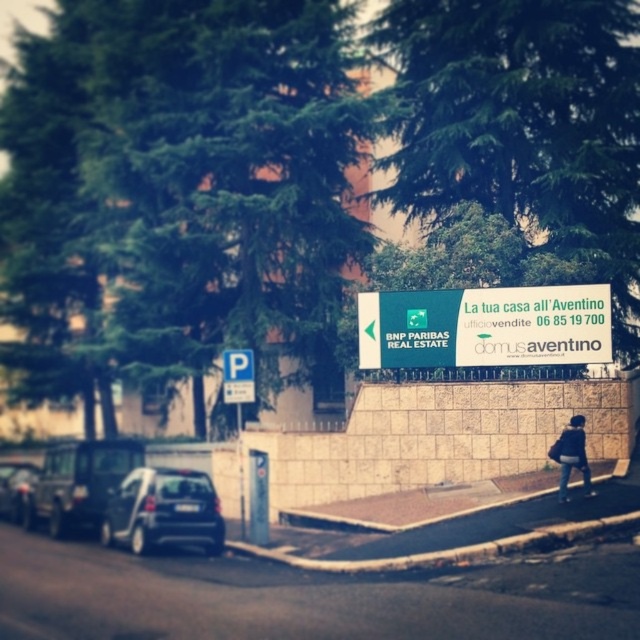
Who is taller, green leafy tree at upper center or black matte car at left?

black matte car at left

Can you confirm if green leafy tree at upper center is positioned below black matte car at left?

No, green leafy tree at upper center is not below black matte car at left.

The image size is (640, 640). What do you see at coordinates (522, 124) in the screenshot?
I see `green leafy tree at upper center` at bounding box center [522, 124].

What are the coordinates of `green leafy tree at upper center` in the screenshot? It's located at (522, 124).

Does dark blue jeans at lower right appear under metallic silver car at left?

No, dark blue jeans at lower right is not below metallic silver car at left.

Who is positioned more to the right, dark blue jeans at lower right or metallic silver car at left?

Positioned to the right is dark blue jeans at lower right.

Does point (570, 451) come closer to viewer compared to point (26, 472)?

Yes, point (570, 451) is closer to viewer.

You are a GUI agent. You are given a task and a screenshot of the screen. Output one action in this format:
    pyautogui.click(x=<x>, y=<y>)
    Task: Click on the dark blue jeans at lower right
    The image size is (640, 640).
    Given the screenshot: What is the action you would take?
    pyautogui.click(x=572, y=456)

Is point (563, 492) farther from viewer compared to point (225, 401)?

No, it is in front of (225, 401).

Is point (579, 433) positioned before point (234, 349)?

Yes, point (579, 433) is in front of point (234, 349).

Where is `dark blue jeans at lower right`? The width and height of the screenshot is (640, 640). dark blue jeans at lower right is located at coordinates (572, 456).